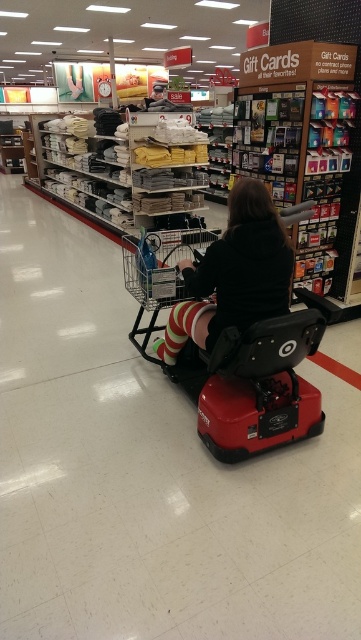
Question: Which object is farther from the camera taking this photo?

Choices:
 (A) striped socks at center
 (B) red plastic mobility scooter at center

Answer: (A)

Question: Can you confirm if red plastic mobility scooter at center is bigger than striped socks at center?

Choices:
 (A) yes
 (B) no

Answer: (A)

Question: Is red plastic mobility scooter at center thinner than striped socks at center?

Choices:
 (A) yes
 (B) no

Answer: (B)

Question: Can you confirm if red plastic mobility scooter at center is bigger than striped socks at center?

Choices:
 (A) no
 (B) yes

Answer: (B)

Question: Which object appears farthest from the camera in this image?

Choices:
 (A) red plastic mobility scooter at center
 (B) striped socks at center

Answer: (B)